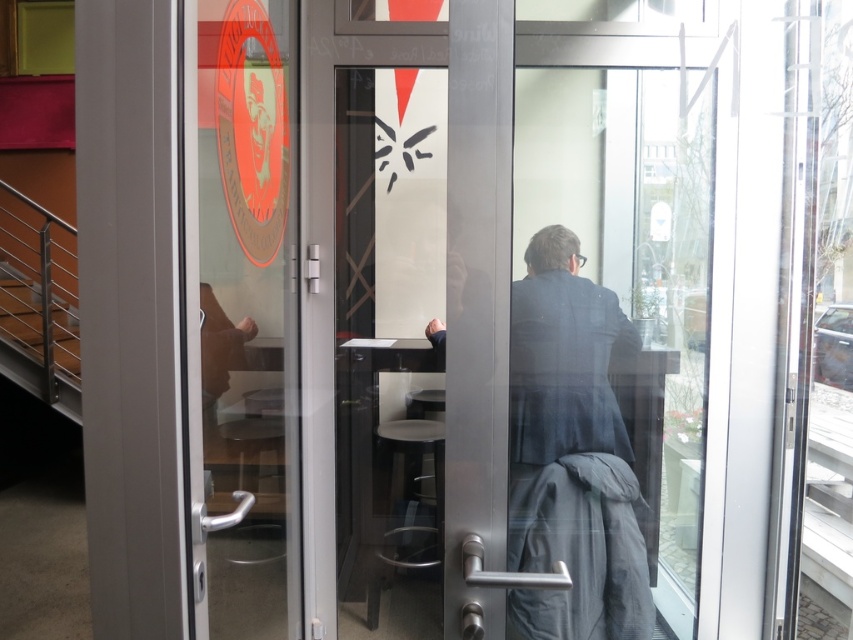
Does transparent glass door at left appear on the right side of gray woolen robe at center?

In fact, transparent glass door at left is to the left of gray woolen robe at center.

Is transparent glass door at left bigger than gray woolen robe at center?

Yes, transparent glass door at left is bigger than gray woolen robe at center.

You are a GUI agent. You are given a task and a screenshot of the screen. Output one action in this format:
    pyautogui.click(x=<x>, y=<y>)
    Task: Click on the transparent glass door at left
    Image resolution: width=853 pixels, height=640 pixels.
    Given the screenshot: What is the action you would take?
    pyautogui.click(x=248, y=314)

Locate an element on the screen. The width and height of the screenshot is (853, 640). transparent glass door at left is located at coordinates (248, 314).